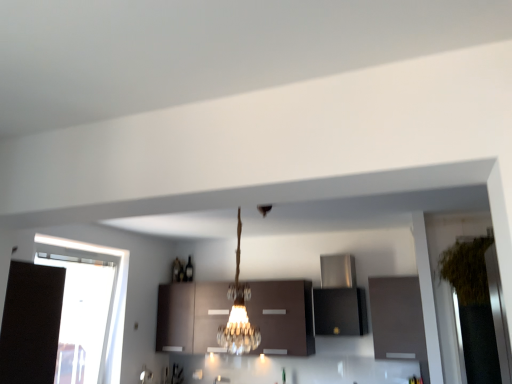
This screenshot has height=384, width=512. Describe the element at coordinates (340, 311) in the screenshot. I see `stainless steel range hood at upper center, placed as the second cabinetry when sorted from left to right` at that location.

Where is `transparent glass window at left`? The width and height of the screenshot is (512, 384). transparent glass window at left is located at coordinates (112, 303).

Is green leafy plant at right in front of or behind matte brown cabinet at right, the third cabinetry when ordered from left to right, in the image?

green leafy plant at right is in front of matte brown cabinet at right, the third cabinetry when ordered from left to right.

Considering the positions of objects green leafy plant at right and matte brown cabinet at right, the third cabinetry when ordered from left to right, in the image provided, who is more to the right, green leafy plant at right or matte brown cabinet at right, the third cabinetry when ordered from left to right,?

green leafy plant at right is more to the right.

Is green leafy plant at right inside the boundaries of matte brown cabinet at right, the third cabinetry when ordered from left to right, or outside?

green leafy plant at right is located beyond the bounds of matte brown cabinet at right, the third cabinetry when ordered from left to right.

Based on the photo, considering the relative sizes of green leafy plant at right and matte brown cabinet at right, the third cabinetry when ordered from left to right, in the image provided, is green leafy plant at right shorter than matte brown cabinet at right, the third cabinetry when ordered from left to right,?

In fact, green leafy plant at right may be taller than matte brown cabinet at right, the third cabinetry when ordered from left to right.

From a real-world perspective, is transparent glass window at left physically below stainless steel range hood at upper center, which is the 2th cabinetry in right-to-left order?

Yes, from a real-world perspective, transparent glass window at left is below stainless steel range hood at upper center, which is the 2th cabinetry in right-to-left order.

Which of these two, transparent glass window at left or stainless steel range hood at upper center, placed as the second cabinetry when sorted from left to right, is thinner?

With smaller width is transparent glass window at left.

Is transparent glass window at left at the left side of stainless steel range hood at upper center, placed as the second cabinetry when sorted from left to right?

Indeed, transparent glass window at left is positioned on the left side of stainless steel range hood at upper center, placed as the second cabinetry when sorted from left to right.

Measure the distance between transparent glass window at left and stainless steel range hood at upper center, placed as the second cabinetry when sorted from left to right.

transparent glass window at left and stainless steel range hood at upper center, placed as the second cabinetry when sorted from left to right, are 6.77 feet apart.

Considering the sizes of objects green leafy plant at right and matte brown cabinets at center, which is the third cabinetry in right-to-left order, in the image provided, who is thinner, green leafy plant at right or matte brown cabinets at center, which is the third cabinetry in right-to-left order,?

matte brown cabinets at center, which is the third cabinetry in right-to-left order, is thinner.

Is green leafy plant at right bigger or smaller than matte brown cabinets at center, the 1th cabinetry when ordered from left to right?

green leafy plant at right is smaller than matte brown cabinets at center, the 1th cabinetry when ordered from left to right.

Is green leafy plant at right positioned far away from matte brown cabinets at center, which is the third cabinetry in right-to-left order?

Yes, green leafy plant at right is far from matte brown cabinets at center, which is the third cabinetry in right-to-left order.

Considering the sizes of objects green leafy plant at right and matte brown cabinets at center, the 1th cabinetry when ordered from left to right, in the image provided, who is shorter, green leafy plant at right or matte brown cabinets at center, the 1th cabinetry when ordered from left to right,?

matte brown cabinets at center, the 1th cabinetry when ordered from left to right.

This screenshot has width=512, height=384. In order to click on plant above the stainless steel range hood at upper center, placed as the second cabinetry when sorted from left to right (from the image's perspective) in this screenshot , I will do `click(467, 270)`.

How much distance is there between green leafy plant at right and stainless steel range hood at upper center, placed as the second cabinetry when sorted from left to right?

green leafy plant at right and stainless steel range hood at upper center, placed as the second cabinetry when sorted from left to right, are 38.27 inches apart.

Would you say green leafy plant at right is inside or outside stainless steel range hood at upper center, placed as the second cabinetry when sorted from left to right?

green leafy plant at right cannot be found inside stainless steel range hood at upper center, placed as the second cabinetry when sorted from left to right.

Based on their sizes in the image, would you say green leafy plant at right is bigger or smaller than stainless steel range hood at upper center, which is the 2th cabinetry in right-to-left order?

Considering their sizes, green leafy plant at right takes up more space than stainless steel range hood at upper center, which is the 2th cabinetry in right-to-left order.

From a real-world perspective, who is located lower, green leafy plant at right or transparent glass window at left?

transparent glass window at left is physically lower.

Is green leafy plant at right wider than transparent glass window at left?

Indeed, green leafy plant at right has a greater width compared to transparent glass window at left.

How different are the orientations of green leafy plant at right and transparent glass window at left in degrees?

90 degrees separate the facing orientations of green leafy plant at right and transparent glass window at left.

Between green leafy plant at right and transparent glass window at left, which one appears on the left side from the viewer's perspective?

transparent glass window at left.

Consider the image. From the image's perspective, which is above, matte brown cabinet at right, the third cabinetry when ordered from left to right, or stainless steel range hood at upper center, which is the 2th cabinetry in right-to-left order?

stainless steel range hood at upper center, which is the 2th cabinetry in right-to-left order, from the image's perspective.

From a real-world perspective, is matte brown cabinet at right, marked as the first cabinetry in a right-to-left arrangement, physically above stainless steel range hood at upper center, which is the 2th cabinetry in right-to-left order?

No.

From the picture: Is matte brown cabinet at right, marked as the first cabinetry in a right-to-left arrangement, at the right side of stainless steel range hood at upper center, which is the 2th cabinetry in right-to-left order?

Yes, matte brown cabinet at right, marked as the first cabinetry in a right-to-left arrangement, is to the right of stainless steel range hood at upper center, which is the 2th cabinetry in right-to-left order.

Who is taller, matte brown cabinet at right, marked as the first cabinetry in a right-to-left arrangement, or transparent glass window at left?

transparent glass window at left is taller.

Is matte brown cabinet at right, marked as the first cabinetry in a right-to-left arrangement, not close to transparent glass window at left?

Yes, matte brown cabinet at right, marked as the first cabinetry in a right-to-left arrangement, is far from transparent glass window at left.

Considering the positions of objects matte brown cabinet at right, marked as the first cabinetry in a right-to-left arrangement, and transparent glass window at left in the image provided, who is more to the left, matte brown cabinet at right, marked as the first cabinetry in a right-to-left arrangement, or transparent glass window at left?

transparent glass window at left is more to the left.

Does matte brown cabinet at right, the third cabinetry when ordered from left to right, have a greater width compared to transparent glass window at left?

Indeed, matte brown cabinet at right, the third cabinetry when ordered from left to right, has a greater width compared to transparent glass window at left.

The width and height of the screenshot is (512, 384). In order to click on the 1st cabinetry behind the green leafy plant at right, counting from the anchor's position in this screenshot , I will do pos(397,318).

I want to click on cabinetry that appears above the transparent glass window at left (from the image's perspective), so (x=340, y=311).

Looking at the image, which one is located closer to matte brown cabinets at center, which is the third cabinetry in right-to-left order, stainless steel range hood at upper center, placed as the second cabinetry when sorted from left to right, or green leafy plant at right?

The object closer to matte brown cabinets at center, which is the third cabinetry in right-to-left order, is stainless steel range hood at upper center, placed as the second cabinetry when sorted from left to right.

Considering their positions, is transparent glass window at left positioned further to matte brown cabinets at center, the 1th cabinetry when ordered from left to right, than green leafy plant at right?

green leafy plant at right.

Considering their positions, is stainless steel range hood at upper center, placed as the second cabinetry when sorted from left to right, positioned closer to transparent glass window at left than green leafy plant at right?

Among the two, stainless steel range hood at upper center, placed as the second cabinetry when sorted from left to right, is located nearer to transparent glass window at left.

When comparing their distances from transparent glass window at left, does green leafy plant at right or stainless steel range hood at upper center, which is the 2th cabinetry in right-to-left order, seem further?

green leafy plant at right.

Based on the photo, based on their spatial positions, is transparent glass window at left or matte brown cabinets at center, the 1th cabinetry when ordered from left to right, closer to matte brown cabinet at right, the third cabinetry when ordered from left to right?

matte brown cabinets at center, the 1th cabinetry when ordered from left to right, is positioned closer to the anchor matte brown cabinet at right, the third cabinetry when ordered from left to right.

Looking at the image, which one is located further to matte brown cabinets at center, the 1th cabinetry when ordered from left to right, stainless steel range hood at upper center, which is the 2th cabinetry in right-to-left order, or matte brown cabinet at right, the third cabinetry when ordered from left to right?

matte brown cabinet at right, the third cabinetry when ordered from left to right.

From the image, which object appears to be farther from stainless steel range hood at upper center, which is the 2th cabinetry in right-to-left order, transparent glass window at left or matte brown cabinet at right, marked as the first cabinetry in a right-to-left arrangement?

The object further to stainless steel range hood at upper center, which is the 2th cabinetry in right-to-left order, is transparent glass window at left.

Considering their positions, is transparent glass window at left positioned further to matte brown cabinets at center, which is the third cabinetry in right-to-left order, than stainless steel range hood at upper center, placed as the second cabinetry when sorted from left to right?

stainless steel range hood at upper center, placed as the second cabinetry when sorted from left to right, is further to matte brown cabinets at center, which is the third cabinetry in right-to-left order.

The height and width of the screenshot is (384, 512). What are the coordinates of `cabinetry between green leafy plant at right and stainless steel range hood at upper center, placed as the second cabinetry when sorted from left to right, in the front-back direction` in the screenshot? It's located at (397, 318).

Identify the location of cabinetry between transparent glass window at left and stainless steel range hood at upper center, placed as the second cabinetry when sorted from left to right, in the horizontal direction. The height and width of the screenshot is (384, 512). (191, 316).

Identify the location of cabinetry between matte brown cabinets at center, the 1th cabinetry when ordered from left to right, and matte brown cabinet at right, marked as the first cabinetry in a right-to-left arrangement, from left to right. click(x=340, y=311).